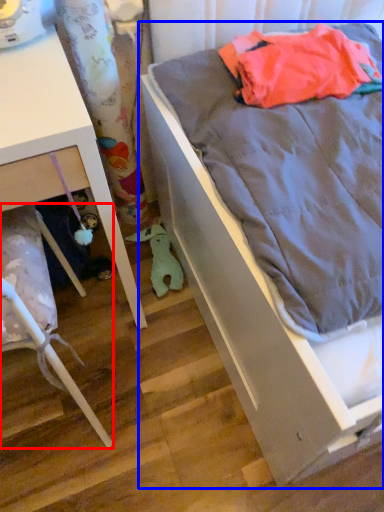
Question: Among these objects, which one is farthest to the camera, furniture (highlighted by a red box) or bed (highlighted by a blue box)?

Choices:
 (A) furniture
 (B) bed

Answer: (A)